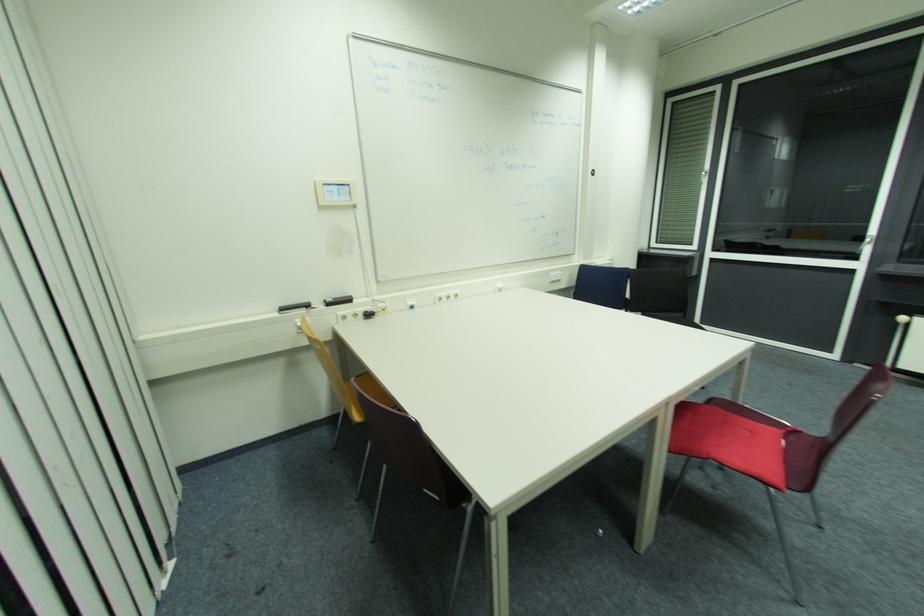
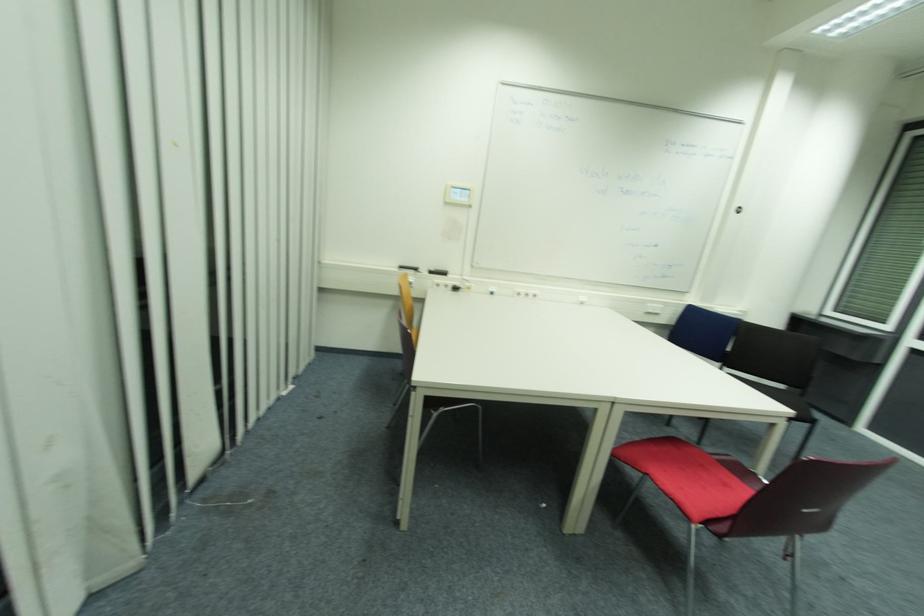
Find the pixel in the second image that matches point (772, 485) in the first image.

(691, 519)